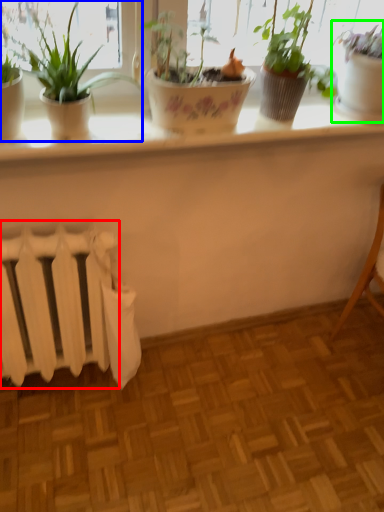
Question: Considering the real-world distances, which object is farthest from radiator (highlighted by a red box)? houseplant (highlighted by a blue box) or houseplant (highlighted by a green box)?

Choices:
 (A) houseplant
 (B) houseplant

Answer: (B)